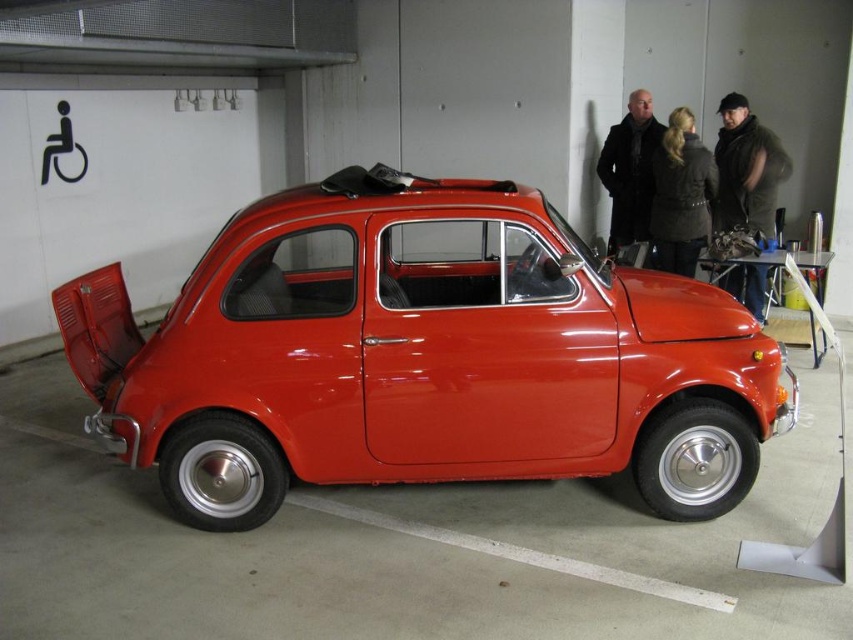
You are a delivery person who needs to place a large package on the roof of the glossy red car at center. However, there is a black wool coat at upper right hanging above it. Can you safely place the package without disturbing the coat?

The glossy red car at center is positioned under the black wool coat at upper right, so placing the package on the roof might displace the coat. You should check if the coat can be moved or secured before proceeding.

You are a delivery person who needs to load a large package into the trunk of the glossy red car at center. The package is as tall as the black wool coat at upper right. Will the package fit vertically in the trunk?

The glossy red car at center is much taller than the black wool coat at upper right. Since the package is as tall as the coat, it will fit vertically in the trunk.

You are a delivery person who needs to place a large package in the trunk of the vintage red car. The package is 1.2 meters wide. The trunk has a width of 1 meter. You see the dark brown leather jacket at upper right and the black wool coat at upper right hanging on the trunk lid. Which coat should you fold first to make space?

The dark brown leather jacket at upper right is wider than the black wool coat at upper right. Therefore, you should fold the dark brown leather jacket at upper right first to make more space in the trunk.